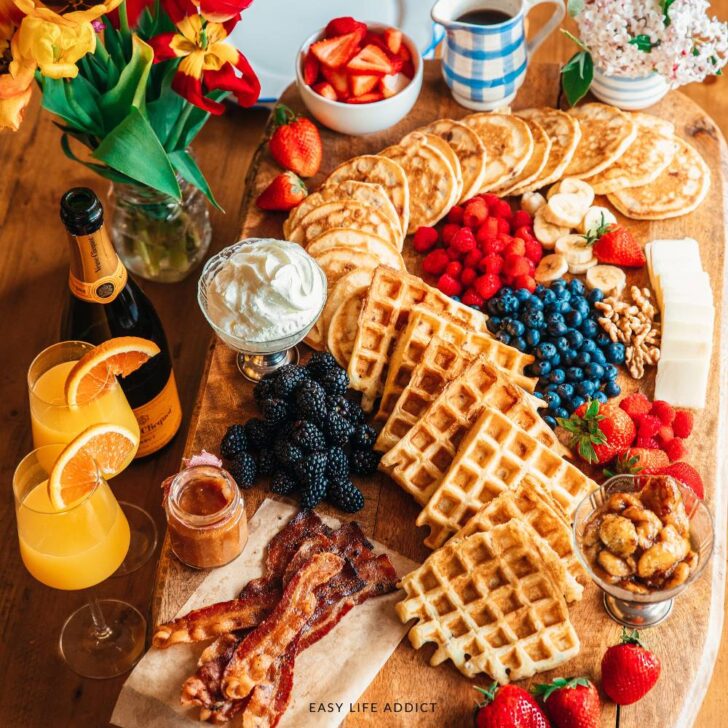
Identify the location of table. The height and width of the screenshot is (728, 728). (23, 185), (231, 164), (712, 712).